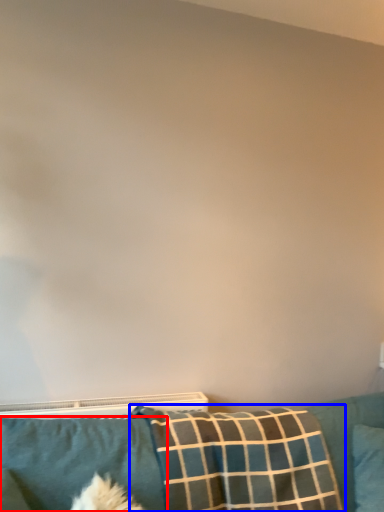
Question: Among these objects, which one is nearest to the camera, pillow (highlighted by a red box) or pillow (highlighted by a blue box)?

Choices:
 (A) pillow
 (B) pillow

Answer: (A)